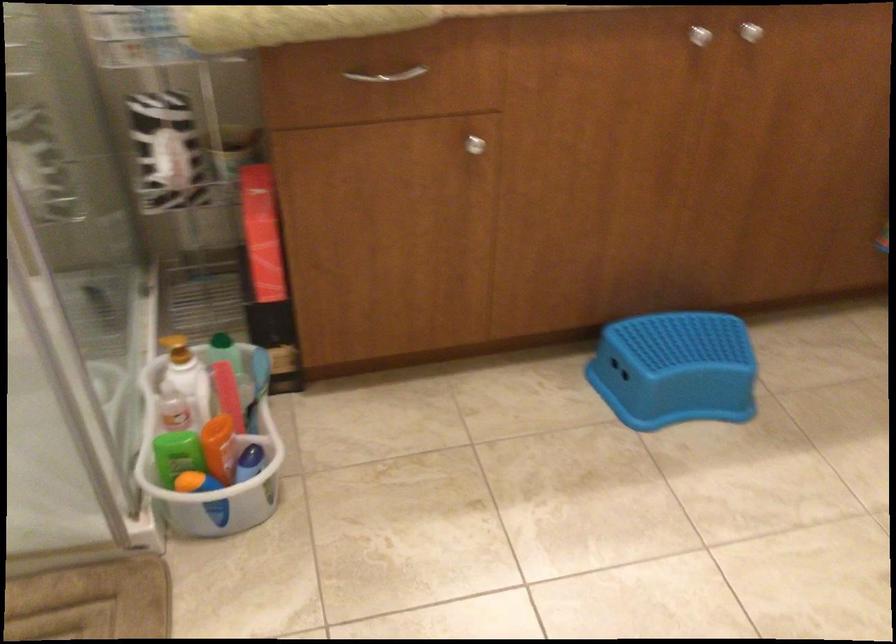
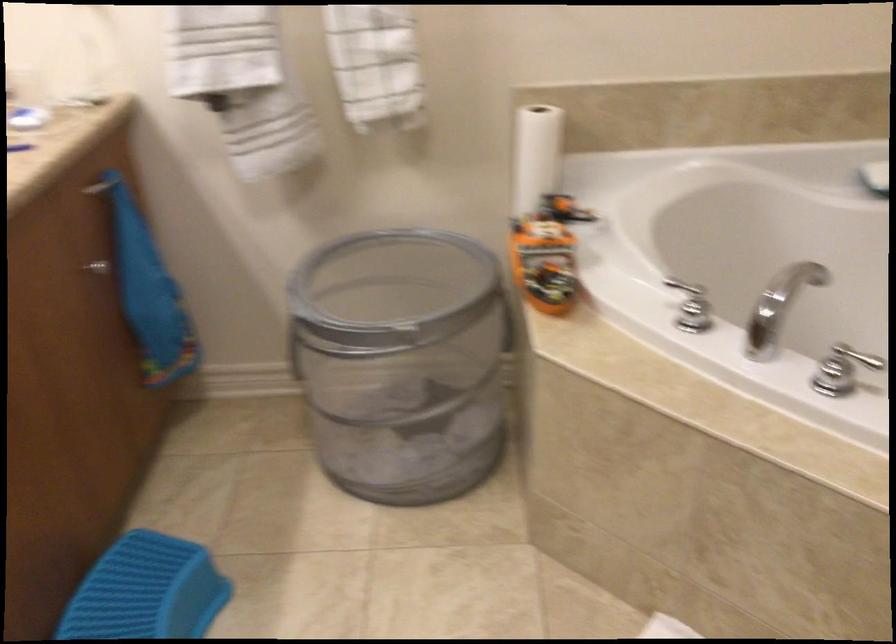
The point at (x=682, y=345) is marked in the first image. Where is the corresponding point in the second image?

(147, 591)